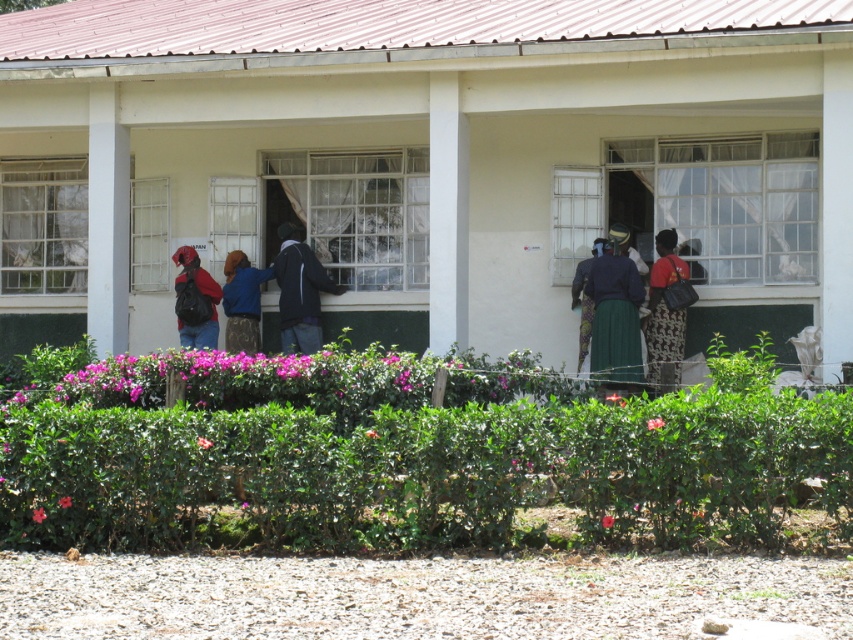
Question: Which point is farther to the camera?

Choices:
 (A) red fabric dress at center
 (B) green textured skirt at center

Answer: (B)

Question: Can you confirm if red fabric dress at center is positioned to the right of matte black backpack at left?

Choices:
 (A) yes
 (B) no

Answer: (A)

Question: Estimate the real-world distances between objects in this image. Which object is closer to the red fabric dress at center?

Choices:
 (A) green textured skirt at center
 (B) green leafy hedge at center

Answer: (A)

Question: Where is green leafy hedge at center located in relation to dark green skirt at center in the image?

Choices:
 (A) left
 (B) right

Answer: (A)

Question: Which object is farther from the camera taking this photo?

Choices:
 (A) green textured skirt at center
 (B) red fabric dress at center
 (C) green leafy hedge at center
 (D) blue fabric jacket at center

Answer: (D)

Question: Can you confirm if dark green skirt at center is positioned above green textured skirt at center?

Choices:
 (A) no
 (B) yes

Answer: (B)